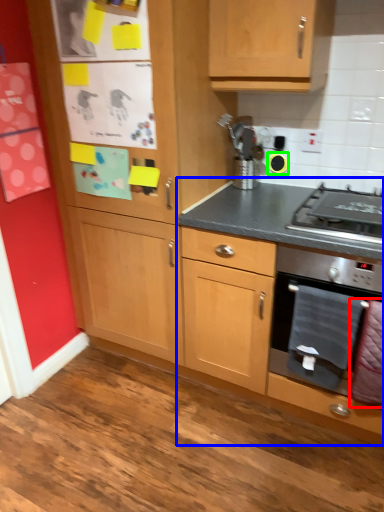
Question: Which is nearer to the blanket (highlighted by a red box)? cabinetry (highlighted by a blue box) or appliance (highlighted by a green box).

Choices:
 (A) cabinetry
 (B) appliance

Answer: (A)